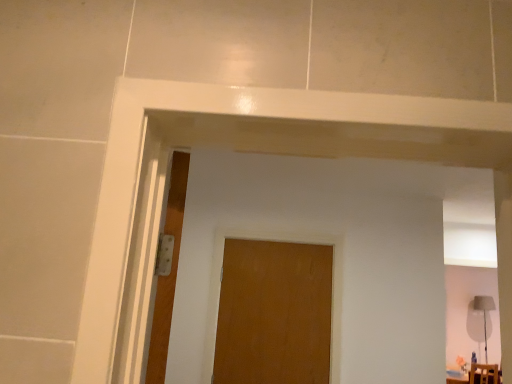
Where is `wooden door at center`? wooden door at center is located at coordinates (274, 313).

Image resolution: width=512 pixels, height=384 pixels. What do you see at coordinates (274, 313) in the screenshot?
I see `wooden door at center` at bounding box center [274, 313].

In order to face wooden door at center, should I rotate leftwards or rightwards?

It's best to rotate right around 2.119 degrees.

I want to click on wooden door at center, so click(274, 313).